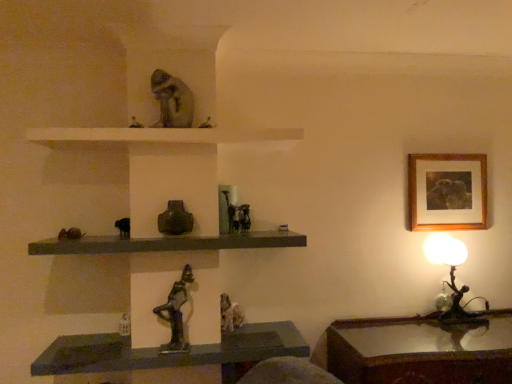
Question: Is bronze statue at center, which is the 2th animal from bottom to top, at the left side of matte stone chameleon at upper center, which appears as the 4th animal when ordered from the bottom?

Choices:
 (A) no
 (B) yes

Answer: (A)

Question: From the image's perspective, is bronze statue at center, which is the 2th animal from bottom to top, below matte stone chameleon at upper center, which appears as the 4th animal when ordered from the bottom?

Choices:
 (A) yes
 (B) no

Answer: (A)

Question: From a real-world perspective, is bronze statue at center, which is the 2th animal from bottom to top, on top of matte stone chameleon at upper center, which appears as the 4th animal when ordered from the bottom?

Choices:
 (A) yes
 (B) no

Answer: (B)

Question: Can you confirm if bronze statue at center, positioned as the third animal in top-to-bottom order, is thinner than matte stone chameleon at upper center, which appears as the 4th animal when ordered from the bottom?

Choices:
 (A) yes
 (B) no

Answer: (A)

Question: From a real-world perspective, is bronze statue at center, positioned as the third animal in top-to-bottom order, positioned under matte stone chameleon at upper center, which appears as the 4th animal when ordered from the bottom, based on gravity?

Choices:
 (A) no
 (B) yes

Answer: (B)

Question: Is bronze statue at center, which is the 2th animal from bottom to top, oriented towards matte stone chameleon at upper center, the first animal viewed from the top?

Choices:
 (A) yes
 (B) no

Answer: (B)

Question: Can you confirm if metallic statue at center, the second animal positioned from the top, is smaller than wooden table at lower right?

Choices:
 (A) yes
 (B) no

Answer: (A)

Question: Would you say metallic statue at center, positioned as the third animal in bottom-to-top order, is outside wooden table at lower right?

Choices:
 (A) no
 (B) yes

Answer: (B)

Question: Is metallic statue at center, the second animal positioned from the top, bigger than wooden table at lower right?

Choices:
 (A) yes
 (B) no

Answer: (B)

Question: From a real-world perspective, is metallic statue at center, positioned as the third animal in bottom-to-top order, physically above wooden table at lower right?

Choices:
 (A) no
 (B) yes

Answer: (B)

Question: Is metallic statue at center, positioned as the third animal in bottom-to-top order, turned away from wooden table at lower right?

Choices:
 (A) no
 (B) yes

Answer: (A)

Question: Is metallic statue at center, the second animal positioned from the top, at the left side of wooden table at lower right?

Choices:
 (A) no
 (B) yes

Answer: (B)

Question: Is metallic statue at center turned away from rustic stone figurine at center, which is the 4th animal in top-to-bottom order?

Choices:
 (A) no
 (B) yes

Answer: (A)